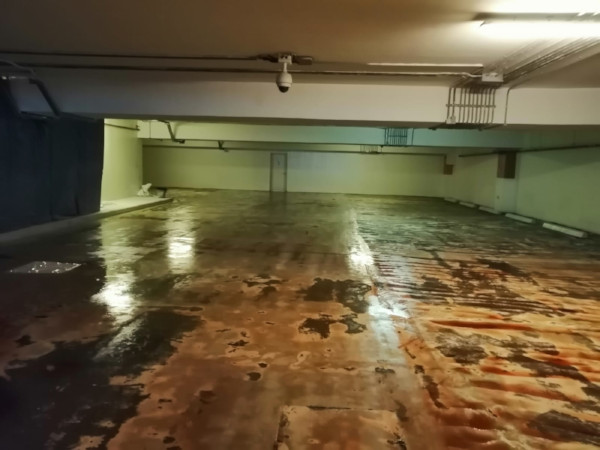
Find the location of a particular element. gray wall is located at coordinates (47, 175).